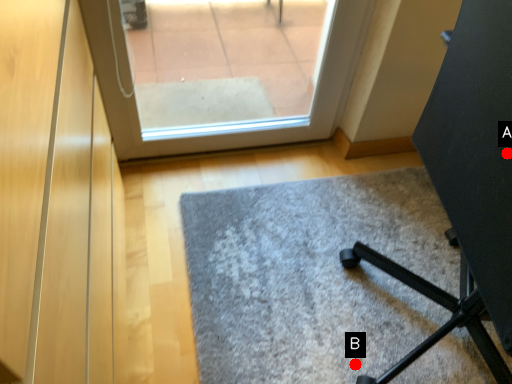
Question: Two points are circled on the image, labeled by A and B beside each circle. Which point is closer to the camera taking this photo?

Choices:
 (A) A is closer
 (B) B is closer

Answer: (A)